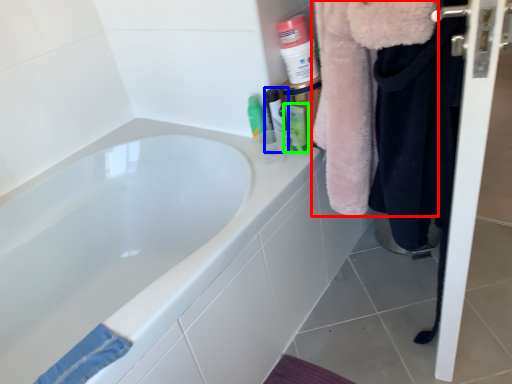
Question: Which object is positioned farthest from fur coat (highlighted by a red box)? Select from mouthwash (highlighted by a blue box) and mouthwash (highlighted by a green box).

Choices:
 (A) mouthwash
 (B) mouthwash

Answer: (A)